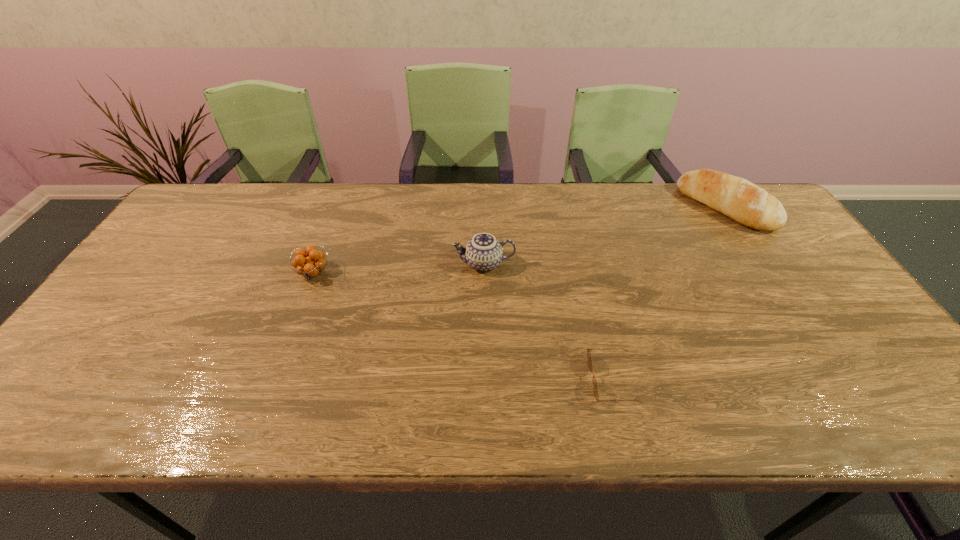
Identify the location of vacant point at the near edge. This screenshot has width=960, height=540. (401, 419).

The width and height of the screenshot is (960, 540). In the image, there is a desktop. What are the coordinates of `vacant space at the left edge` in the screenshot? It's located at click(121, 338).

Locate an element on the screen. Image resolution: width=960 pixels, height=540 pixels. vacant space at the right edge of the desktop is located at coordinates (758, 254).

Where is `free space between the third object from right to left and the bread`? This screenshot has width=960, height=540. free space between the third object from right to left and the bread is located at coordinates (605, 235).

You are a GUI agent. You are given a task and a screenshot of the screen. Output one action in this format:
    pyautogui.click(x=<x>, y=<y>)
    Task: Click on the vacant area between the shortest object and the chinaware
    This screenshot has width=960, height=540.
    Given the screenshot: What is the action you would take?
    click(548, 321)

At what (x,y) coordinates should I click in order to perform the action: click on vacant region between the bread and the sunglasses. Please return your answer as a coordinate pair (x, y). Looking at the image, I should click on (669, 293).

You are a GUI agent. You are given a task and a screenshot of the screen. Output one action in this format:
    pyautogui.click(x=<x>, y=<y>)
    Task: Click on the vacant area between the orange fruit and the second object from left to right
    The image size is (960, 540).
    Given the screenshot: What is the action you would take?
    pyautogui.click(x=398, y=268)

The height and width of the screenshot is (540, 960). Find the location of `vacant point located between the nearest object and the second shortest object`. vacant point located between the nearest object and the second shortest object is located at coordinates pos(463,326).

Identify the location of free space between the nearest object and the leftmost object. The width and height of the screenshot is (960, 540). (463, 326).

At what (x,y) coordinates should I click in order to perform the action: click on free space between the third object from right to left and the leftmost object. Please return your answer as a coordinate pair (x, y). This screenshot has height=540, width=960. Looking at the image, I should click on (398, 268).